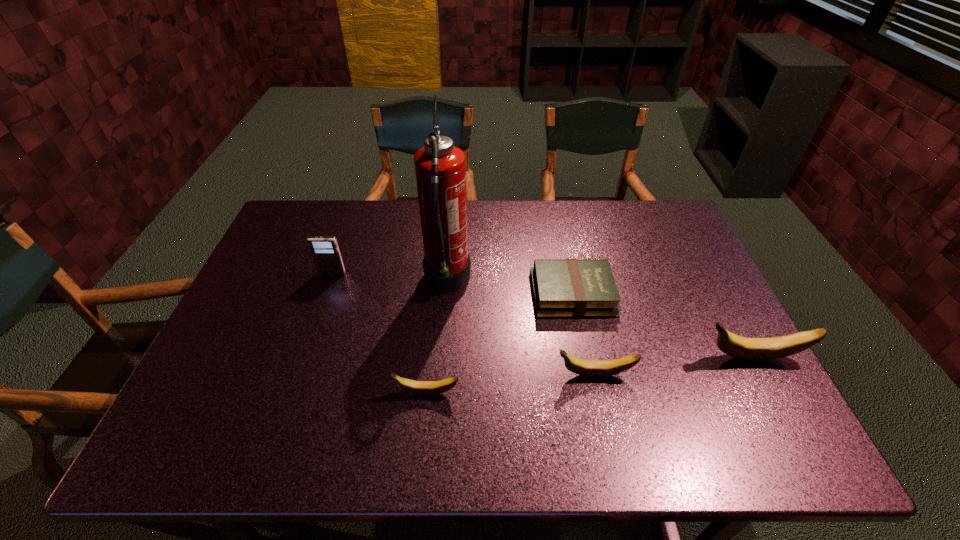
The image size is (960, 540). In order to click on free space located 0.100m at the stem of the nearest banana in this screenshot , I will do `click(351, 393)`.

The width and height of the screenshot is (960, 540). I want to click on vacant point located at the stem of the nearest banana, so click(252, 393).

The image size is (960, 540). What are the coordinates of `free space located at the stem of the fourth tallest object` in the screenshot? It's located at (535, 375).

Where is `vacant region located at the stem of the fourth tallest object`? The height and width of the screenshot is (540, 960). vacant region located at the stem of the fourth tallest object is located at coordinates (447, 375).

This screenshot has height=540, width=960. What are the coordinates of `free space located at the stem of the fourth tallest object` in the screenshot? It's located at (522, 375).

Identify the location of blank area located 0.360m at the stem of the farthest banana. The width and height of the screenshot is (960, 540). (554, 358).

Identify the location of vacant space positioned 0.350m at the stem of the farthest banana. This screenshot has height=540, width=960. (558, 358).

Identify the location of free region located 0.210m at the stem of the farthest banana. This screenshot has height=540, width=960. (614, 358).

Identify the location of free space located 0.090m on the front-facing side of the leftmost object. (324, 297).

At what (x,y) coordinates should I click in order to perform the action: click on blank space located 0.110m on the front-facing side of the fire extinguisher. Please return your answer as a coordinate pair (x, y). The image size is (960, 540). Looking at the image, I should click on 509,283.